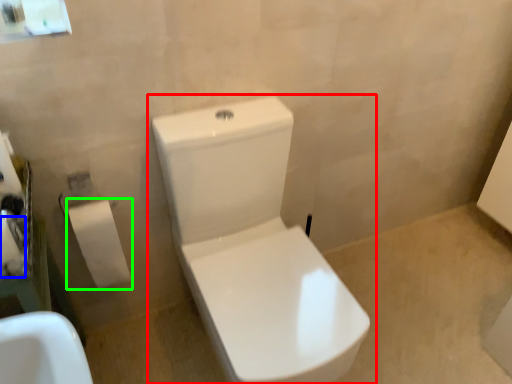
Question: Based on their relative distances, which object is farther from toilet (highlighted by a red box)? Choose from toilet paper (highlighted by a blue box) and toiletry (highlighted by a green box).

Choices:
 (A) toilet paper
 (B) toiletry

Answer: (A)